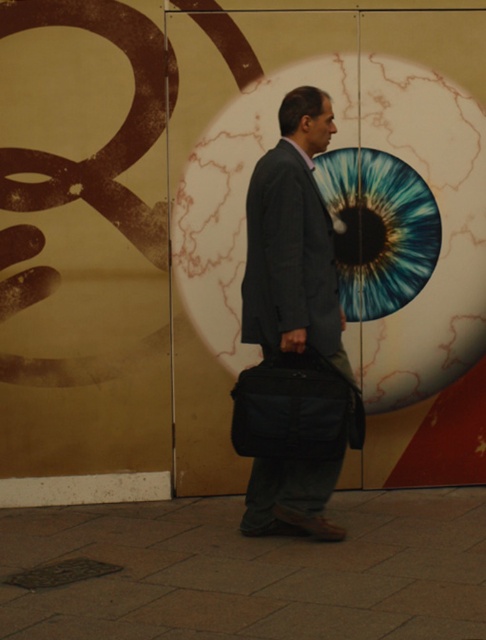
Question: Can you confirm if dark gray suit at center is positioned above black fabric bag at center?

Choices:
 (A) yes
 (B) no

Answer: (A)

Question: Is dark gray suit at center thinner than black fabric bag at center?

Choices:
 (A) no
 (B) yes

Answer: (B)

Question: Can you confirm if dark gray suit at center is wider than black fabric bag at center?

Choices:
 (A) no
 (B) yes

Answer: (A)

Question: Which of the following is the closest to the observer?

Choices:
 (A) (265, 317)
 (B) (245, 426)

Answer: (B)